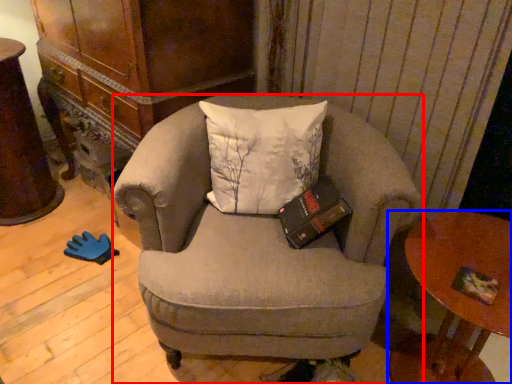
Question: Which object is closer to the camera taking this photo, chair (highlighted by a red box) or table (highlighted by a blue box)?

Choices:
 (A) chair
 (B) table

Answer: (B)